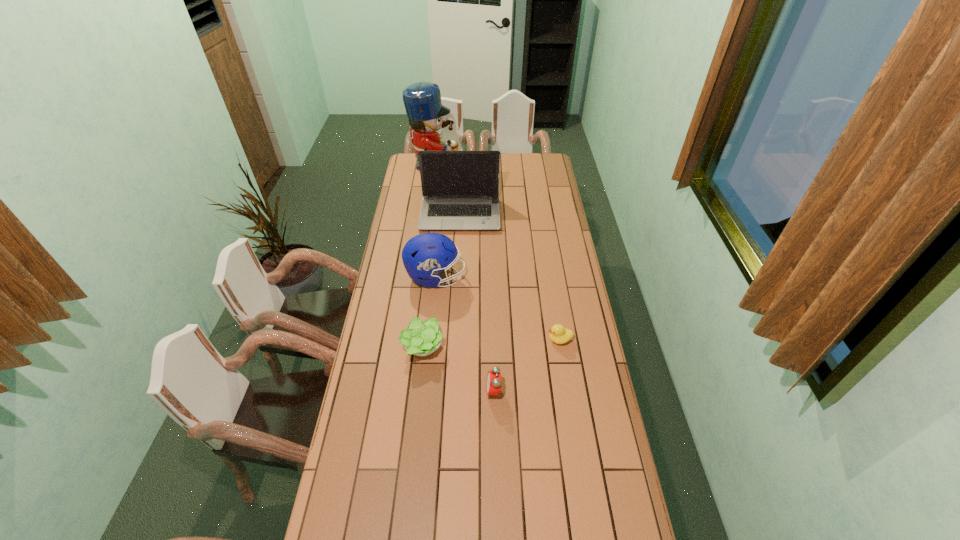
This screenshot has height=540, width=960. What are the coordinates of `vacant area that lies between the nearest object and the lettuce` in the screenshot? It's located at (458, 369).

Identify the location of free spot between the fourth nearest object and the duckling. (497, 308).

Find the location of a particular element. This screenshot has height=540, width=960. vacant space in between the duckling and the lettuce is located at coordinates (491, 343).

Find the location of a particular element. The image size is (960, 540). vacant region between the nutcracker and the duckling is located at coordinates (497, 253).

You are a GUI agent. You are given a task and a screenshot of the screen. Output one action in this format:
    pyautogui.click(x=<x>, y=<y>)
    Task: Click on the free space between the third farthest object and the lettuce
    
    Given the screenshot: What is the action you would take?
    pyautogui.click(x=429, y=312)

Identify the location of object that stands as the closest to the second farthest object. (422, 100).

Point out which object is positioned as the third nearest to the rightmost object. Please provide its 2D coordinates. Your answer should be formatted as a tuple, i.e. [(x, y)], where the tuple contains the x and y coordinates of a point satisfying the conditions above.

[(420, 338)]

This screenshot has width=960, height=540. I want to click on free spot that satisfies the following two spatial constraints: 1. on the back side of the lettuce; 2. on the front-facing side of the tallest object, so 443,167.

At what (x,y) coordinates should I click in order to perform the action: click on free space in the image that satisfies the following two spatial constraints: 1. on the back side of the lettuce; 2. on the front-facing side of the nutcracker. Please return your answer as a coordinate pair (x, y). This screenshot has height=540, width=960. Looking at the image, I should click on 443,167.

Where is `vacant position in the image that satisfies the following two spatial constraints: 1. on the front-facing side of the lettuce; 2. on the left side of the nutcracker`? The height and width of the screenshot is (540, 960). vacant position in the image that satisfies the following two spatial constraints: 1. on the front-facing side of the lettuce; 2. on the left side of the nutcracker is located at coordinates (410, 348).